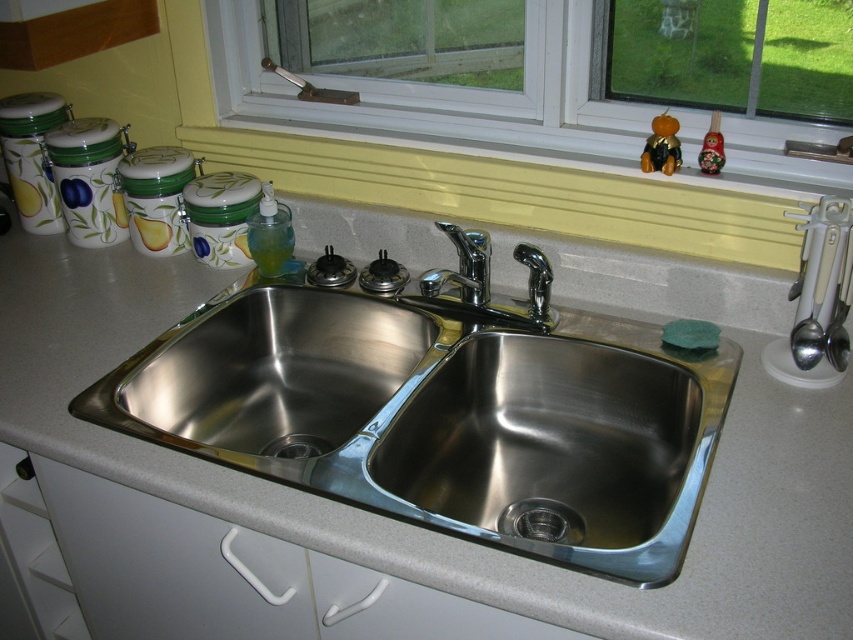
Question: Which of the following is the farthest from the observer?

Choices:
 (A) white plastic window at upper center
 (B) satin steel utensils at right
 (C) yellow painted wood at upper center
 (D) chrome/metallic faucet at center

Answer: (D)

Question: Which of the following is the closest to the observer?

Choices:
 (A) (480, 298)
 (B) (799, 273)
 (C) (735, 134)
 (D) (285, 376)

Answer: (B)

Question: In this image, where is yellow painted wood at upper center located relative to polished chrome faucet at center?

Choices:
 (A) above
 (B) below

Answer: (A)

Question: Can you confirm if satin steel utensils at right is bigger than chrome/metallic faucet at center?

Choices:
 (A) no
 (B) yes

Answer: (A)

Question: Based on their relative distances, which object is farther from the yellow painted wood at upper center?

Choices:
 (A) satin steel utensils at right
 (B) polished chrome faucet at center
 (C) chrome/metallic faucet at center
 (D) white plastic window at upper center

Answer: (A)

Question: Is white plastic window at upper center wider than polished chrome faucet at center?

Choices:
 (A) no
 (B) yes

Answer: (B)